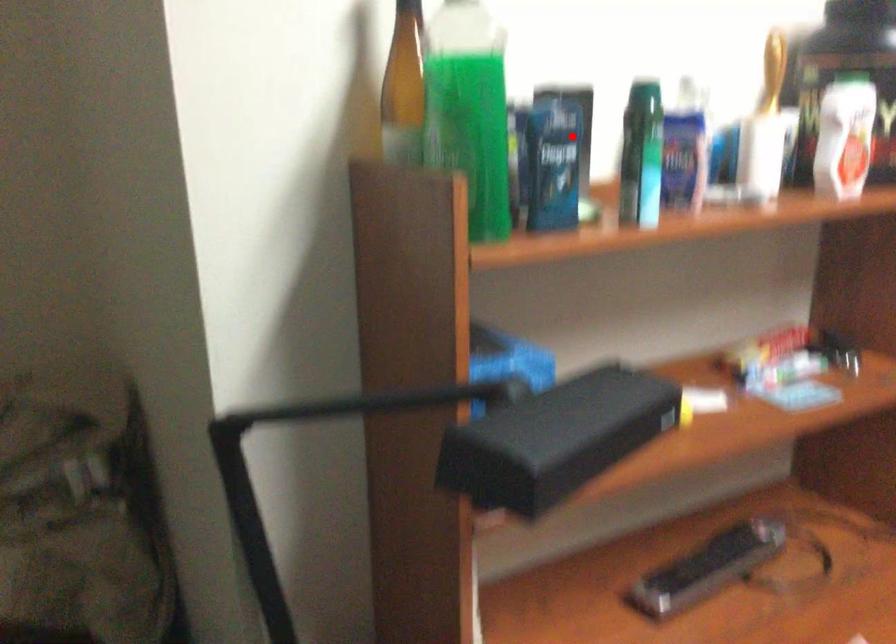
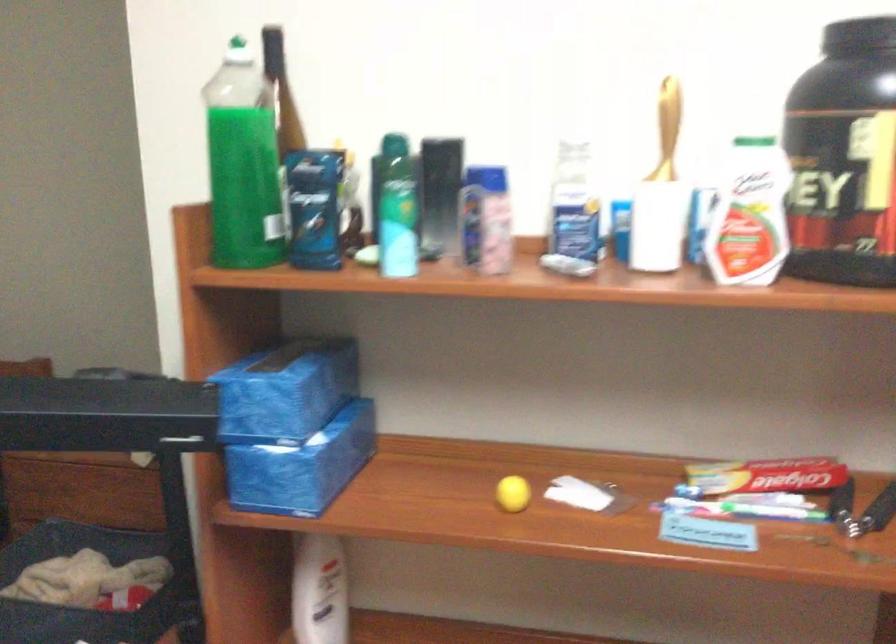
Locate, in the second image, the point that corresponds to the highlighted location in the first image.

(438, 194)